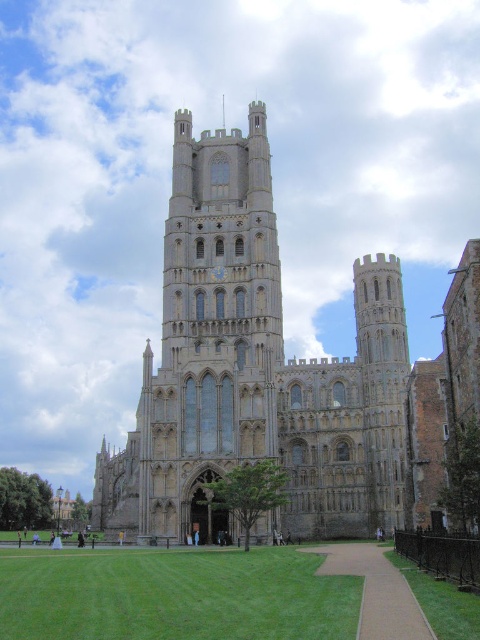
You are a tourist visiting Ely Cathedral. You see the stone church at center and the light brown paved path at lower center. Which object takes up more space in the image?

The stone church at center is bigger than the light brown paved path at lower center, so it takes up more space in the image.

Based on the photo, you are standing at the entrance of Ely Cathedral and want to walk towards the green grass at lower right. Which direction should you head relative to the light brown paved path at lower center?

Since the light brown paved path at lower center is in front of the green grass at lower right, you should head towards the green grass at lower right by moving past the light brown paved path at lower center.